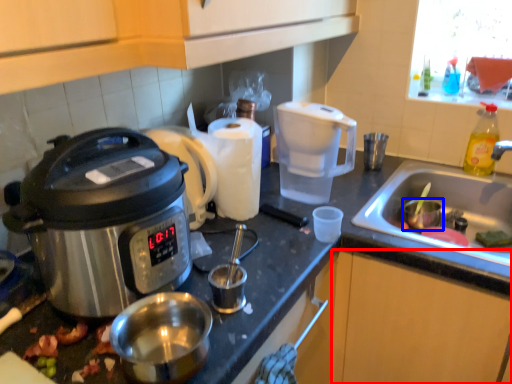
Question: Among these objects, which one is nearest to the camera, cabinetry (highlighted by a red box) or coffee cup (highlighted by a blue box)?

Choices:
 (A) cabinetry
 (B) coffee cup

Answer: (A)